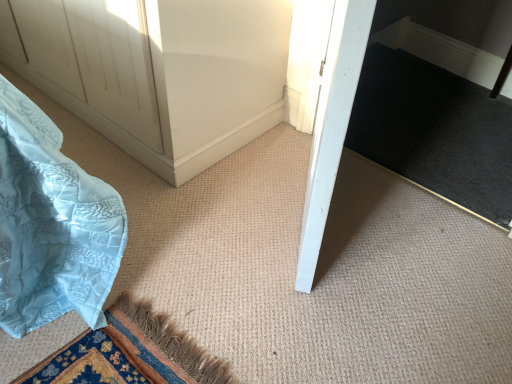
Identify the location of free space in front of white smooth door at center. Image resolution: width=512 pixels, height=384 pixels. pyautogui.click(x=302, y=306).